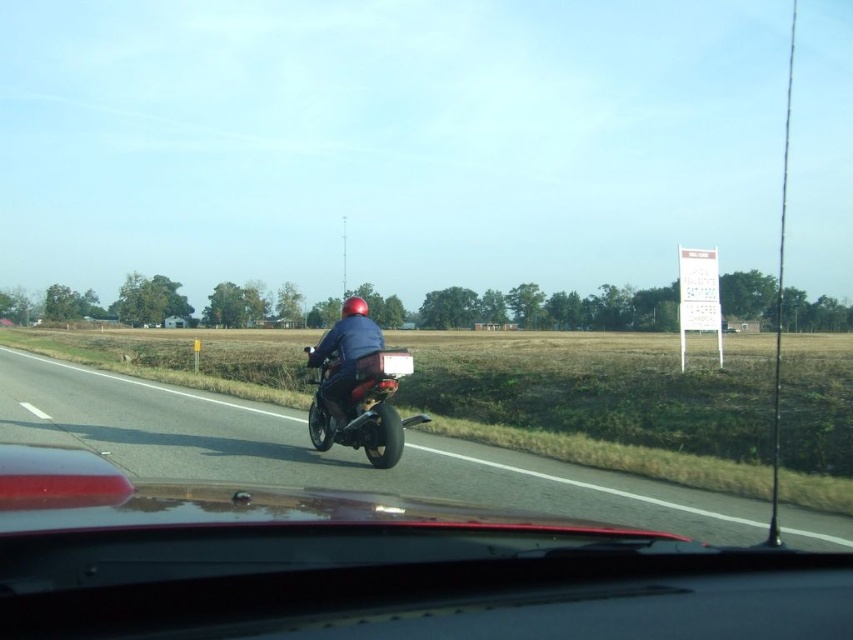
Question: Among these objects, which one is farthest from the camera?

Choices:
 (A) shiny black motorcycle at center
 (B) black rubber motorcycle at center
 (C) glossy red motorcycle at center

Answer: (A)

Question: Where is glossy red motorcycle at center located in relation to shiny black motorcycle at center in the image?

Choices:
 (A) left
 (B) right

Answer: (B)

Question: Which point appears farthest from the camera in this image?

Choices:
 (A) (361, 312)
 (B) (328, 392)
 (C) (525, 464)

Answer: (A)

Question: Can you confirm if black rubber motorcycle at center is bigger than matte blue jacket at center?

Choices:
 (A) no
 (B) yes

Answer: (B)

Question: Which point is closer to the camera?

Choices:
 (A) glossy red motorcycle at center
 (B) matte blue jacket at center
 (C) shiny black motorcycle at center
 (D) black rubber motorcycle at center

Answer: (A)

Question: Is glossy red motorcycle at center wider than shiny black motorcycle at center?

Choices:
 (A) yes
 (B) no

Answer: (B)